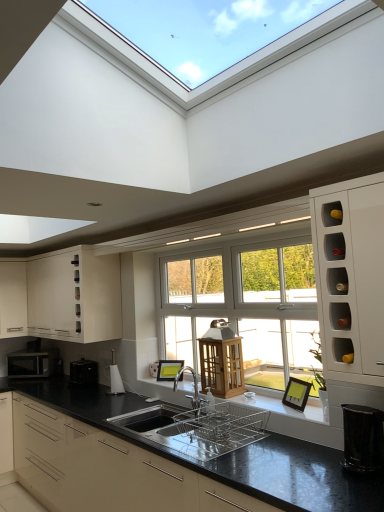
Question: Based on their sizes in the image, would you say black glossy trash can at lower right, arranged as the first appliance when viewed from the front, is bigger or smaller than silver metallic tap at center?

Choices:
 (A) small
 (B) big

Answer: (A)

Question: In the image, is black glossy trash can at lower right, placed as the first appliance when sorted from right to left, on the left side or the right side of silver metallic tap at center?

Choices:
 (A) right
 (B) left

Answer: (A)

Question: Which object is the farthest from the white matte cabinet at left, which is the third cabinetry in top-to-bottom order?

Choices:
 (A) silver metallic microwave at left
 (B) black plastic toaster at lower left, which is the fourth appliance in front-to-back order
 (C) matte white cabinet at upper left, positioned as the second cabinetry in top-to-bottom order
 (D) black matte countertop at center, arranged as the 1th cabinetry when ordered from the bottom
 (E) black glossy trash can at lower right, arranged as the first appliance when viewed from the front

Answer: (E)

Question: Considering the real-world distances, which object is closest to the polished stainless steel dish rack at center, the second appliance positioned from the front?

Choices:
 (A) white glossy wine rack at right, the 4th cabinetry when ordered from bottom to top
 (B) black plastic toaster at lower left, which is counted as the 1th appliance, starting from the left
 (C) matte black kettle at lower center, the 2th appliance from the left
 (D) matte white cabinet at upper left, positioned as the second cabinetry in top-to-bottom order
 (E) black matte countertop at center, arranged as the 1th cabinetry when ordered from the bottom

Answer: (E)